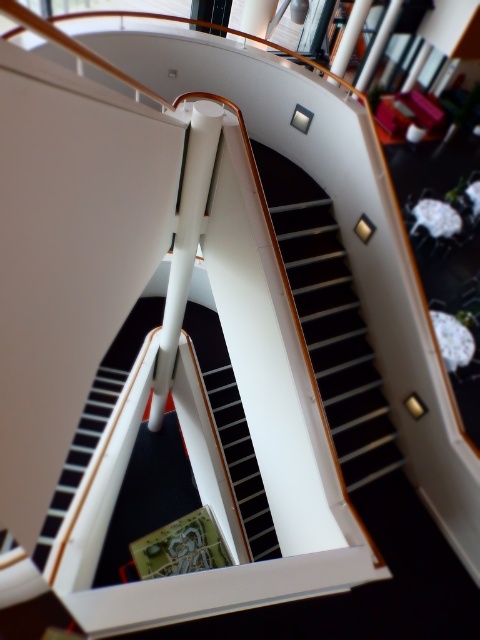
Question: Which point is closer to the camera?

Choices:
 (A) (368, 456)
 (B) (69, 477)

Answer: (A)

Question: Is wooden stair at center below black glossy stair at center?

Choices:
 (A) yes
 (B) no

Answer: (B)

Question: Can you confirm if wooden stair at center is positioned to the left of black glossy stair at center?

Choices:
 (A) no
 (B) yes

Answer: (A)

Question: Does wooden stair at center have a smaller size compared to black glossy stair at center?

Choices:
 (A) yes
 (B) no

Answer: (B)